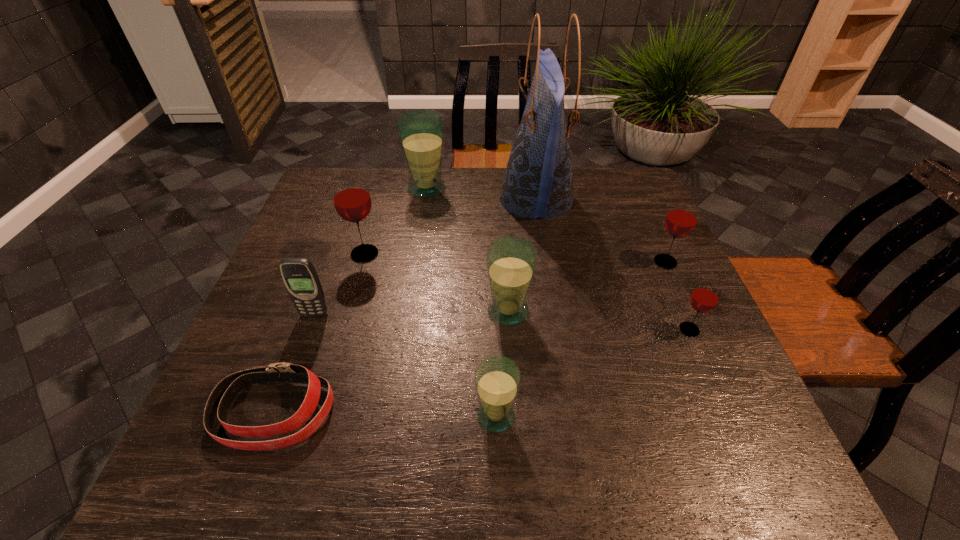
Locate an element on the screen. vacant space that satisfies the following two spatial constraints: 1. on the front side of the smallest red glass; 2. on the left side of the second nearest blue glass is located at coordinates 510,330.

In order to click on vacant space that satisfies the following two spatial constraints: 1. on the screen of the smallest red glass; 2. on the left side of the cellular telephone in this screenshot , I will do 309,330.

The height and width of the screenshot is (540, 960). I want to click on free location that satisfies the following two spatial constraints: 1. on the back side of the leftmost red glass; 2. on the left side of the tallest object, so click(x=380, y=199).

The height and width of the screenshot is (540, 960). Find the location of `vacant region that satisfies the following two spatial constraints: 1. on the back side of the tallest object; 2. on the right side of the second nearest blue glass`. vacant region that satisfies the following two spatial constraints: 1. on the back side of the tallest object; 2. on the right side of the second nearest blue glass is located at coordinates (501, 199).

The height and width of the screenshot is (540, 960). Identify the location of vacant position in the image that satisfies the following two spatial constraints: 1. on the front side of the leftmost blue glass; 2. on the left side of the tallest object. (425, 199).